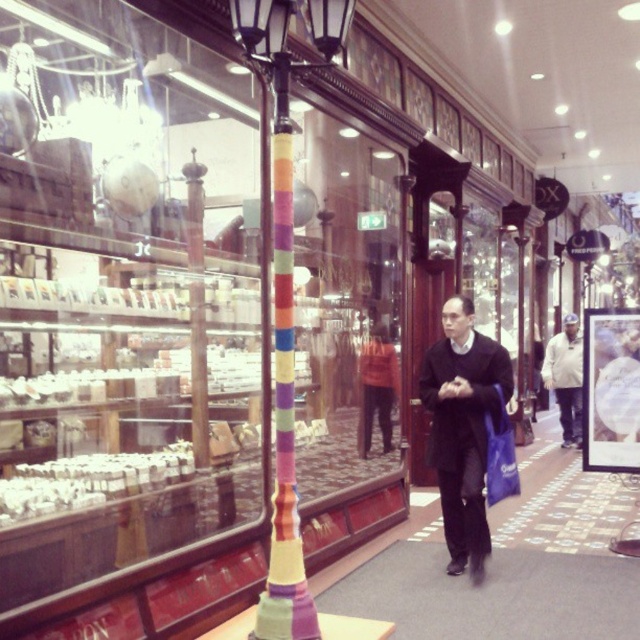
Does multicolored yarn wrapped pole at center have a smaller size compared to multicolored fabric pole at center?

No.

Measure the distance between multicolored yarn wrapped pole at center and camera.

They are 8.19 feet apart.

What do you see at coordinates (285, 296) in the screenshot? The height and width of the screenshot is (640, 640). I see `multicolored yarn wrapped pole at center` at bounding box center [285, 296].

Where is `multicolored yarn wrapped pole at center`? The height and width of the screenshot is (640, 640). multicolored yarn wrapped pole at center is located at coordinates (285, 296).

Can you confirm if carpeted floor at center is thinner than multicolored fabric pole at center?

Incorrect, carpeted floor at center's width is not less than multicolored fabric pole at center's.

Based on the photo, which is below, carpeted floor at center or multicolored fabric pole at center?

carpeted floor at center

Where is `carpeted floor at center`? The width and height of the screenshot is (640, 640). carpeted floor at center is located at coordinates (x=492, y=595).

Can you confirm if multicolored yarn wrapped pole at center is shorter than matte blue shopping bag at center-right?

No, multicolored yarn wrapped pole at center is not shorter than matte blue shopping bag at center-right.

Can you confirm if multicolored yarn wrapped pole at center is wider than matte blue shopping bag at center-right?

Yes, multicolored yarn wrapped pole at center is wider than matte blue shopping bag at center-right.

What do you see at coordinates (285, 296) in the screenshot? I see `multicolored yarn wrapped pole at center` at bounding box center [285, 296].

I want to click on multicolored yarn wrapped pole at center, so click(285, 296).